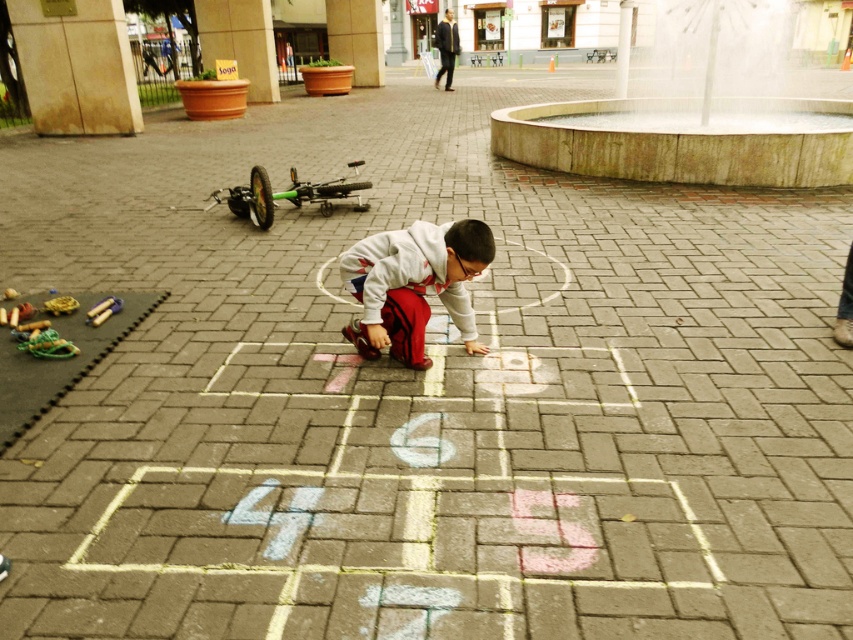
Question: Is stone fountain at center above white fleece jacket at center?

Choices:
 (A) yes
 (B) no

Answer: (A)

Question: Which point appears farthest from the camera in this image?

Choices:
 (A) (469, 234)
 (B) (683, 99)

Answer: (B)

Question: Can you confirm if stone fountain at center is thinner than white fleece jacket at center?

Choices:
 (A) yes
 (B) no

Answer: (B)

Question: Is stone fountain at center to the right of white fleece jacket at center from the viewer's perspective?

Choices:
 (A) yes
 (B) no

Answer: (A)